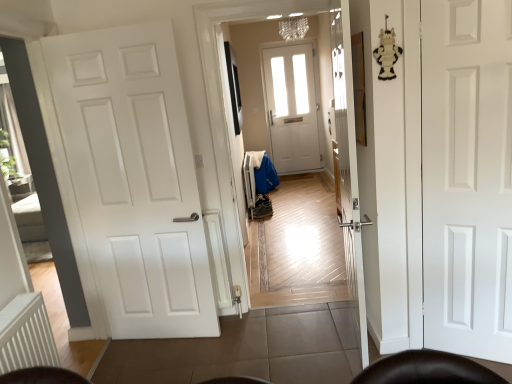
Question: Can you confirm if white matte door at left, which is the 2th door from right to left, is bigger than white matte door at right, which is the 2th door in left-to-right order?

Choices:
 (A) no
 (B) yes

Answer: (B)

Question: Does white matte door at left, which is the 2th door from right to left, appear on the left side of white matte door at right, which is the 2th door in left-to-right order?

Choices:
 (A) yes
 (B) no

Answer: (A)

Question: Does white matte door at left, acting as the 1th door starting from the left, come behind white matte door at right, which is the 2th door in left-to-right order?

Choices:
 (A) yes
 (B) no

Answer: (A)

Question: Is white matte door at left, which is the 2th door from right to left, positioned far away from white matte door at right, acting as the 1th door starting from the right?

Choices:
 (A) no
 (B) yes

Answer: (B)

Question: Does white matte door at left, acting as the 1th door starting from the left, have a lesser height compared to white matte door at right, acting as the 1th door starting from the right?

Choices:
 (A) yes
 (B) no

Answer: (B)

Question: Is white matte door at left, which is the 2th door from right to left, inside the boundaries of white ribbed radiator at lower left, or outside?

Choices:
 (A) outside
 (B) inside

Answer: (A)

Question: Is point (77, 208) positioned closer to the camera than point (36, 309)?

Choices:
 (A) closer
 (B) farther

Answer: (B)

Question: Considering the positions of white matte door at left, which is the 2th door from right to left, and white ribbed radiator at lower left in the image, is white matte door at left, which is the 2th door from right to left, bigger or smaller than white ribbed radiator at lower left?

Choices:
 (A) big
 (B) small

Answer: (A)

Question: In the image, is white matte door at left, acting as the 1th door starting from the left, positioned in front of or behind white ribbed radiator at lower left?

Choices:
 (A) behind
 (B) front

Answer: (A)

Question: In terms of height, does white matte door at right, acting as the 1th door starting from the right, look taller or shorter compared to white matte door at left, which is the 2th door from right to left?

Choices:
 (A) short
 (B) tall

Answer: (A)

Question: Is white matte door at right, which is the 2th door in left-to-right order, bigger or smaller than white matte door at left, acting as the 1th door starting from the left?

Choices:
 (A) small
 (B) big

Answer: (A)

Question: Considering their positions, is white matte door at right, which is the 2th door in left-to-right order, located in front of or behind white matte door at left, acting as the 1th door starting from the left?

Choices:
 (A) behind
 (B) front

Answer: (B)

Question: Does point (421, 168) appear closer or farther from the camera than point (105, 215)?

Choices:
 (A) farther
 (B) closer

Answer: (B)

Question: In terms of size, does white ribbed radiator at lower left appear bigger or smaller than white matte door at left, acting as the 1th door starting from the left?

Choices:
 (A) big
 (B) small

Answer: (B)

Question: Considering the positions of point (54, 362) and point (129, 269), is point (54, 362) closer or farther from the camera than point (129, 269)?

Choices:
 (A) closer
 (B) farther

Answer: (A)